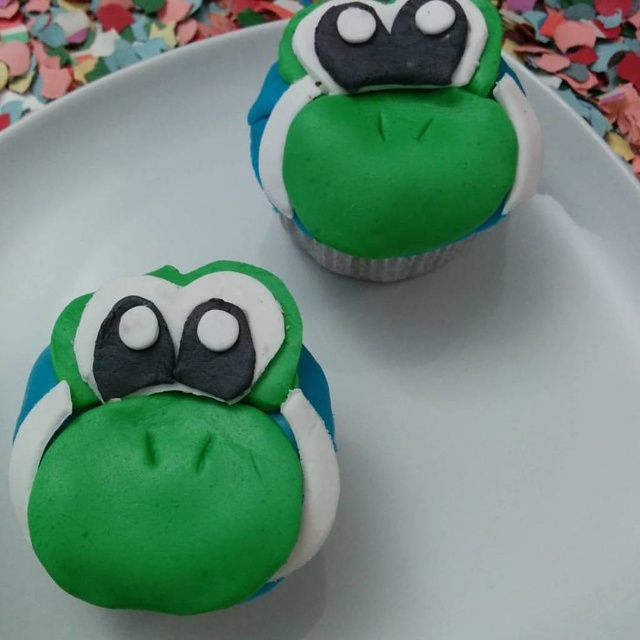
You are looking at the two cupcakes on the plate. Which of the two points, point (164, 520) or point (403, 196), is closer to you?

Point (164, 520) is closer to the viewer than point (403, 196).

You are a baker who needs to place a new cupcake exactly at the center of the plate. The plate has a coordinate system where the bottom left corner is the origin. Can you determine if the green matte cupcake at center is already placed at the center of the plate?

The green matte cupcake at center is located at coordinate point (176, 442), which is not the exact center of the plate. Therefore, it is not placed at the center.